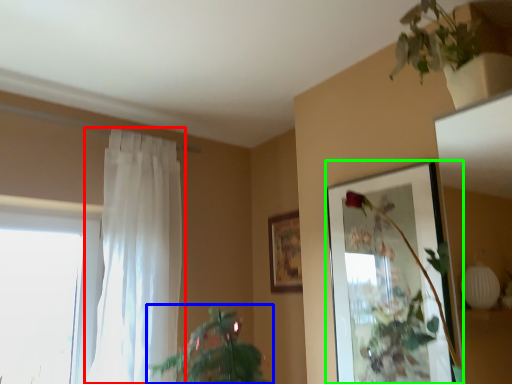
Question: Based on their relative distances, which object is nearer to curtain (highlighted by a red box)? Choose from houseplant (highlighted by a blue box) and picture frame (highlighted by a green box).

Choices:
 (A) houseplant
 (B) picture frame

Answer: (A)